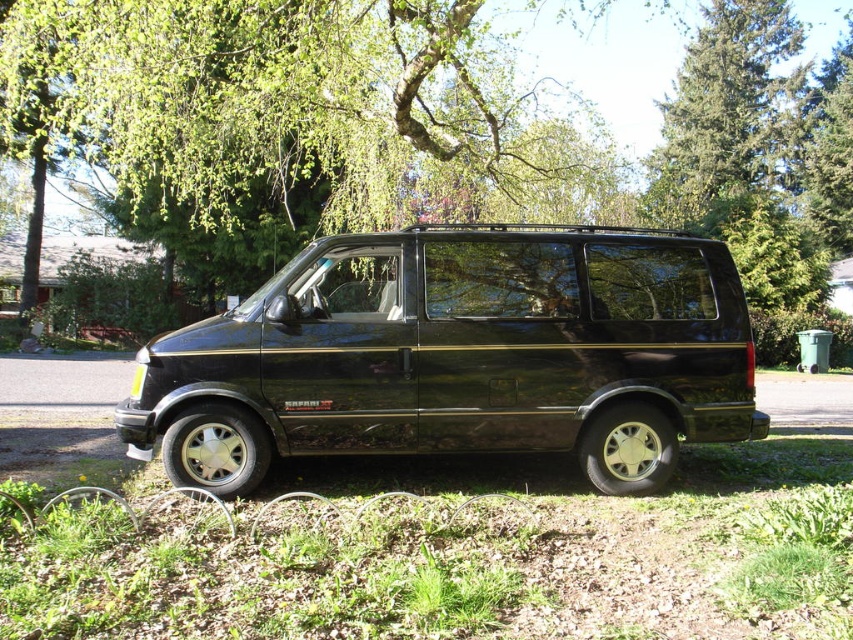
Is green grass at lower center thinner than green needle-like leaves at upper center?

Yes, green grass at lower center is thinner than green needle-like leaves at upper center.

Is green grass at lower center bigger than green needle-like leaves at upper center?

No.

Measure the distance between point (36,540) and camera.

A distance of 13.17 feet exists between point (36,540) and camera.

At what (x,y) coordinates should I click in order to perform the action: click on green grass at lower center. Please return your answer as a coordinate pair (x, y). The width and height of the screenshot is (853, 640). Looking at the image, I should click on (457, 554).

Does point (67, 164) come behind point (546, 582)?

Yes, it is.

Between green leafy tree at upper center and green grass at lower center, which one is positioned lower?

green grass at lower center

Between point (541, 109) and point (456, 612), which one is positioned behind?

The point (541, 109) is more distant.

Identify the location of green leafy tree at upper center. (403, 140).

How distant is green leafy tree at upper center from green needle-like leaves at upper center?

green leafy tree at upper center and green needle-like leaves at upper center are 3.94 meters apart.

Who is higher up, green leafy tree at upper center or green needle-like leaves at upper center?

green needle-like leaves at upper center

Which is behind, point (756, 237) or point (755, 12)?

Positioned behind is point (755, 12).

Locate an element on the screen. The height and width of the screenshot is (640, 853). green leafy tree at upper center is located at coordinates (403, 140).